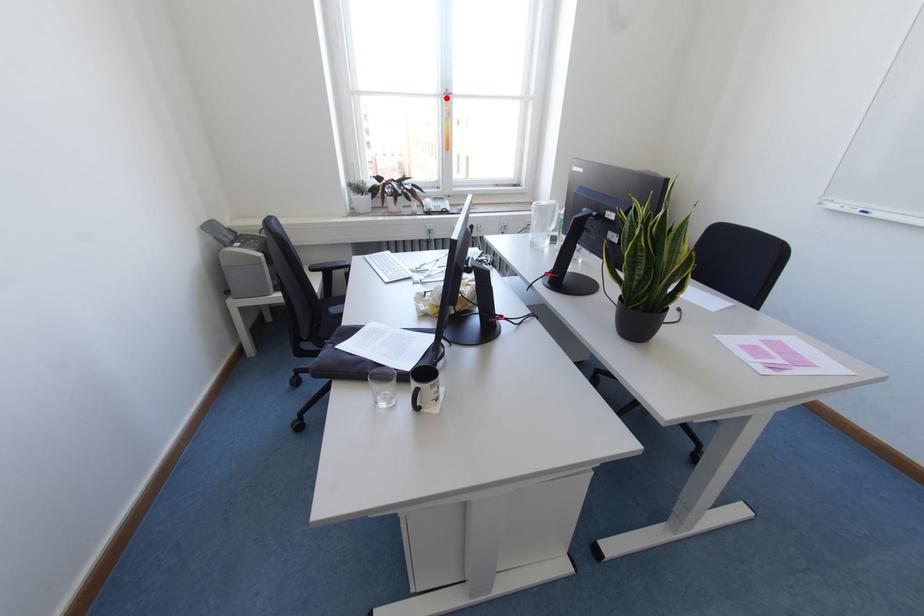
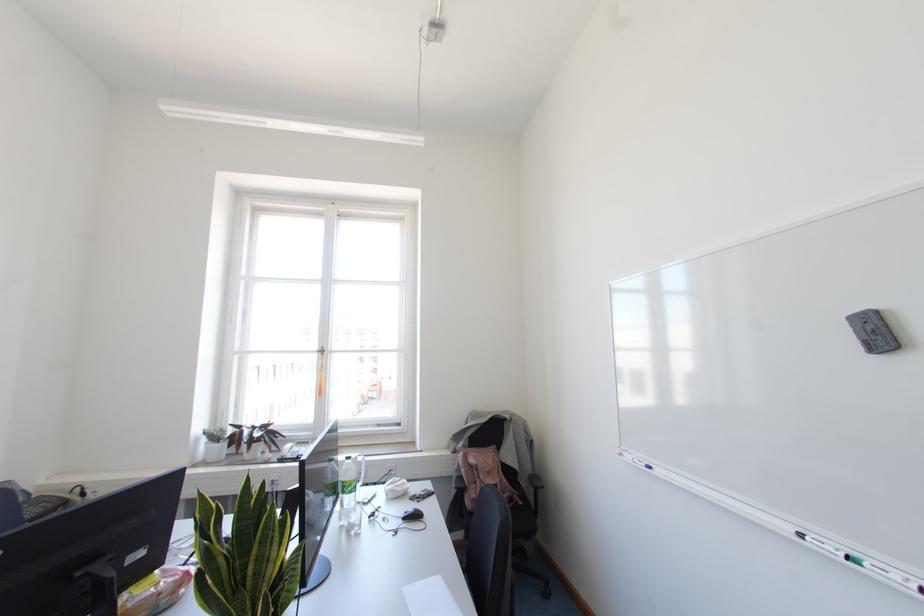
Question: I am providing you with two images of the same scene from different viewpoints. In image1, a red point is highlighted. Considering the same 3D point in image2, which of the following is correct?

Choices:
 (A) It is closer
 (B) It is farther

Answer: (B)